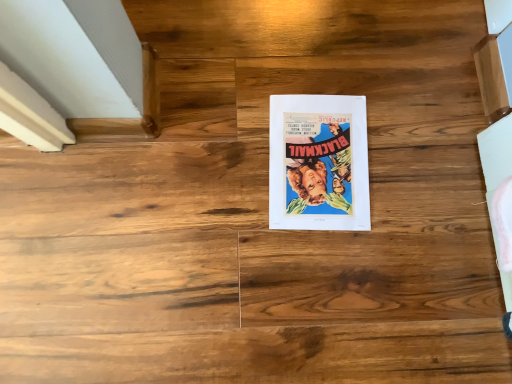
Describe the element at coordinates (319, 163) in the screenshot. This screenshot has height=384, width=512. I see `vibrant paper poster at center` at that location.

Identify the location of vibrant paper poster at center. This screenshot has height=384, width=512. (319, 163).

Where is `vibrant paper poster at center`? vibrant paper poster at center is located at coordinates (319, 163).